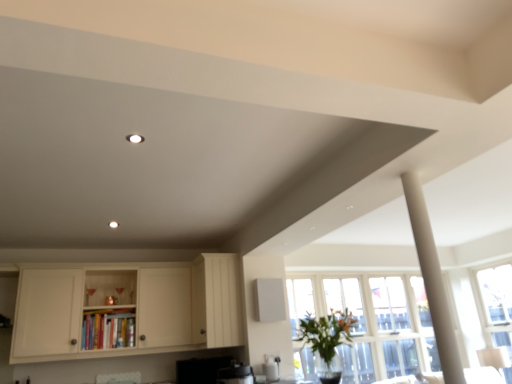
What are the coordinates of `green leafy plant at lower right` in the screenshot? It's located at (327, 342).

At what (x,y) coordinates should I click in order to perform the action: click on white matte cabinet at lower left, the 1th cabinetry viewed from the left. Please return your answer as a coordinate pair (x, y). The height and width of the screenshot is (384, 512). Looking at the image, I should click on (129, 308).

At what (x,y) coordinates should I click in order to perform the action: click on clear glass window at right. Please return your answer as a coordinate pair (x, y). This screenshot has width=512, height=384. Looking at the image, I should click on (496, 303).

The width and height of the screenshot is (512, 384). What do you see at coordinates (496, 303) in the screenshot?
I see `clear glass window at right` at bounding box center [496, 303].

Identify the location of green leafy plant at lower right. (327, 342).

Based on the photo, which of these two, green leafy plant at lower right or white matte column at right, is wider?

Wider between the two is green leafy plant at lower right.

Can you tell me how much green leafy plant at lower right and white matte column at right differ in facing direction?

The angular difference between green leafy plant at lower right and white matte column at right is 2.95 degrees.

In terms of size, does green leafy plant at lower right appear bigger or smaller than white matte column at right?

Considering their sizes, green leafy plant at lower right takes up more space than white matte column at right.

Can we say white matte column at right lies outside clear glass window at right?

Indeed, white matte column at right is completely outside clear glass window at right.

In the scene shown: Is white matte column at right touching clear glass window at right?

No, white matte column at right is not with clear glass window at right.

In the scene shown: How distant is white matte column at right from clear glass window at right?

white matte column at right and clear glass window at right are 3.13 meters apart.

How different are the orientations of white wood cabinet at center, which appears as the second cabinetry when viewed from the left, and clear glass window at right in degrees?

The facing directions of white wood cabinet at center, which appears as the second cabinetry when viewed from the left, and clear glass window at right are 0.349 degrees apart.

Considering the relative positions of white wood cabinet at center, which ranks as the 1th cabinetry in right-to-left order, and clear glass window at right in the image provided, is white wood cabinet at center, which ranks as the 1th cabinetry in right-to-left order, to the left of clear glass window at right from the viewer's perspective?

Correct, you'll find white wood cabinet at center, which ranks as the 1th cabinetry in right-to-left order, to the left of clear glass window at right.

Can you confirm if white wood cabinet at center, which ranks as the 1th cabinetry in right-to-left order, is taller than clear glass window at right?

In fact, white wood cabinet at center, which ranks as the 1th cabinetry in right-to-left order, may be shorter than clear glass window at right.

Is white wood cabinet at center, which appears as the second cabinetry when viewed from the left, directly adjacent to clear glass window at right?

white wood cabinet at center, which appears as the second cabinetry when viewed from the left, and clear glass window at right are clearly separated.

Looking at the image, does white wood cabinet at center, which ranks as the 1th cabinetry in right-to-left order, seem bigger or smaller compared to white matte cabinet at lower left, marked as the second cabinetry in a right-to-left arrangement?

In the image, white wood cabinet at center, which ranks as the 1th cabinetry in right-to-left order, appears to be smaller than white matte cabinet at lower left, marked as the second cabinetry in a right-to-left arrangement.

Considering the sizes of objects white wood cabinet at center, which ranks as the 1th cabinetry in right-to-left order, and white matte cabinet at lower left, the 1th cabinetry viewed from the left, in the image provided, who is thinner, white wood cabinet at center, which ranks as the 1th cabinetry in right-to-left order, or white matte cabinet at lower left, the 1th cabinetry viewed from the left,?

Thinner between the two is white wood cabinet at center, which ranks as the 1th cabinetry in right-to-left order.

From the image's perspective, does white wood cabinet at center, which appears as the second cabinetry when viewed from the left, appear lower than white matte cabinet at lower left, the 1th cabinetry viewed from the left?

Actually, white wood cabinet at center, which appears as the second cabinetry when viewed from the left, appears above white matte cabinet at lower left, the 1th cabinetry viewed from the left, in the image.

Who is shorter, green leafy plant at lower right or white matte cabinet at lower left, the 1th cabinetry viewed from the left?

Standing shorter between the two is green leafy plant at lower right.

Does green leafy plant at lower right come in front of white matte cabinet at lower left, marked as the second cabinetry in a right-to-left arrangement?

Yes.

Which object is positioned more to the left, green leafy plant at lower right or white matte cabinet at lower left, the 1th cabinetry viewed from the left?

white matte cabinet at lower left, the 1th cabinetry viewed from the left.

Between green leafy plant at lower right and white matte cabinet at lower left, the 1th cabinetry viewed from the left, which one has larger size?

white matte cabinet at lower left, the 1th cabinetry viewed from the left.

Is clear glass window at right beside white matte column at right?

No, clear glass window at right is not in contact with white matte column at right.

Consider the image. Which object is closer to the camera taking this photo, clear glass window at right or white matte column at right?

white matte column at right is closer to the camera.

Considering the positions of objects clear glass window at right and white matte column at right in the image provided, who is more to the left, clear glass window at right or white matte column at right?

white matte column at right is more to the left.

This screenshot has width=512, height=384. I want to click on houseplant that is below the white matte column at right (from the image's perspective), so [327, 342].

Does white matte column at right touch green leafy plant at lower right?

They are not placed beside each other.

Is white matte column at right behind green leafy plant at lower right?

No, the depth of white matte column at right is less than that of green leafy plant at lower right.

What's the angular difference between white matte column at right and green leafy plant at lower right's facing directions?

The facing directions of white matte column at right and green leafy plant at lower right are 2.95 degrees apart.

In the image, there is a white matte column at right. In order to click on houseplant below it (from a real-world perspective) in this screenshot , I will do tap(327, 342).

The width and height of the screenshot is (512, 384). What are the coordinates of `pillar on the left of the clear glass window at right` in the screenshot? It's located at (433, 280).

Based on their spatial positions, is white matte cabinet at lower left, the 1th cabinetry viewed from the left, or clear glass window at right further from white matte column at right?

clear glass window at right.

From the image, which object appears to be farther from white matte cabinet at lower left, the 1th cabinetry viewed from the left, white matte column at right or clear glass window at right?

clear glass window at right lies further to white matte cabinet at lower left, the 1th cabinetry viewed from the left, than the other object.

Which object lies further to the anchor point white matte cabinet at lower left, the 1th cabinetry viewed from the left, green leafy plant at lower right or clear glass window at right?

The object further to white matte cabinet at lower left, the 1th cabinetry viewed from the left, is clear glass window at right.

Considering their positions, is white matte cabinet at lower left, the 1th cabinetry viewed from the left, positioned further to white wood cabinet at center, which appears as the second cabinetry when viewed from the left, than clear glass window at right?

The object further to white wood cabinet at center, which appears as the second cabinetry when viewed from the left, is clear glass window at right.

Which object lies further to the anchor point white matte column at right, clear glass window at right or white wood cabinet at center, which ranks as the 1th cabinetry in right-to-left order?

Among the two, clear glass window at right is located further to white matte column at right.

Which object lies nearer to the anchor point white wood cabinet at center, which appears as the second cabinetry when viewed from the left, green leafy plant at lower right or white matte column at right?

Among the two, green leafy plant at lower right is located nearer to white wood cabinet at center, which appears as the second cabinetry when viewed from the left.

Which object lies further to the anchor point white matte cabinet at lower left, marked as the second cabinetry in a right-to-left arrangement, clear glass window at right or white matte column at right?

The object further to white matte cabinet at lower left, marked as the second cabinetry in a right-to-left arrangement, is clear glass window at right.

Estimate the real-world distances between objects in this image. Which object is further from green leafy plant at lower right, white matte column at right or white wood cabinet at center, which appears as the second cabinetry when viewed from the left?

white wood cabinet at center, which appears as the second cabinetry when viewed from the left, is further to green leafy plant at lower right.

The width and height of the screenshot is (512, 384). What are the coordinates of `houseplant between white matte cabinet at lower left, marked as the second cabinetry in a right-to-left arrangement, and white matte column at right from left to right` in the screenshot? It's located at (327, 342).

Find the location of `houseplant between white wood cabinet at center, which appears as the second cabinetry when viewed from the left, and clear glass window at right`. houseplant between white wood cabinet at center, which appears as the second cabinetry when viewed from the left, and clear glass window at right is located at coordinates (327, 342).

Where is `pillar between green leafy plant at lower right and clear glass window at right from left to right`? pillar between green leafy plant at lower right and clear glass window at right from left to right is located at coordinates (433, 280).

This screenshot has height=384, width=512. Identify the location of houseplant between white matte column at right and white wood cabinet at center, which ranks as the 1th cabinetry in right-to-left order, along the z-axis. (327, 342).